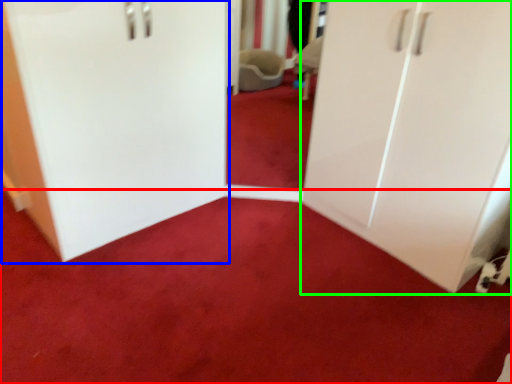
Question: Which object is positioned closest to plain (highlighted by a red box)? Select from door (highlighted by a blue box) and cupboard (highlighted by a green box).

Choices:
 (A) door
 (B) cupboard

Answer: (B)